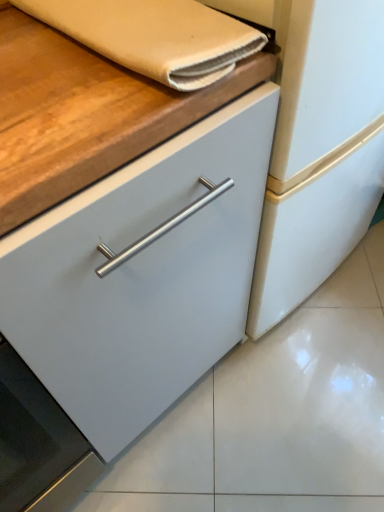
Question: Is beige fabric hand towel at upper left positioned beyond the bounds of black glass oven at lower left?

Choices:
 (A) yes
 (B) no

Answer: (A)

Question: From the image's perspective, would you say beige fabric hand towel at upper left is positioned over black glass oven at lower left?

Choices:
 (A) no
 (B) yes

Answer: (B)

Question: Is beige fabric hand towel at upper left smaller than black glass oven at lower left?

Choices:
 (A) yes
 (B) no

Answer: (A)

Question: Is beige fabric hand towel at upper left thinner than black glass oven at lower left?

Choices:
 (A) yes
 (B) no

Answer: (A)

Question: Does beige fabric hand towel at upper left appear on the left side of black glass oven at lower left?

Choices:
 (A) no
 (B) yes

Answer: (A)

Question: Can you see beige fabric hand towel at upper left touching black glass oven at lower left?

Choices:
 (A) no
 (B) yes

Answer: (A)

Question: Is black glass oven at lower left not within beige fabric hand towel at upper left?

Choices:
 (A) no
 (B) yes

Answer: (B)

Question: From the image's perspective, is black glass oven at lower left over beige fabric hand towel at upper left?

Choices:
 (A) yes
 (B) no

Answer: (B)

Question: From the image's perspective, is black glass oven at lower left beneath beige fabric hand towel at upper left?

Choices:
 (A) yes
 (B) no

Answer: (A)

Question: Can you confirm if black glass oven at lower left is positioned to the right of beige fabric hand towel at upper left?

Choices:
 (A) yes
 (B) no

Answer: (B)

Question: Is black glass oven at lower left to the left of beige fabric hand towel at upper left from the viewer's perspective?

Choices:
 (A) yes
 (B) no

Answer: (A)

Question: From a real-world perspective, does black glass oven at lower left sit lower than beige fabric hand towel at upper left?

Choices:
 (A) yes
 (B) no

Answer: (A)

Question: Is point (44, 13) positioned closer to the camera than point (21, 437)?

Choices:
 (A) closer
 (B) farther

Answer: (A)